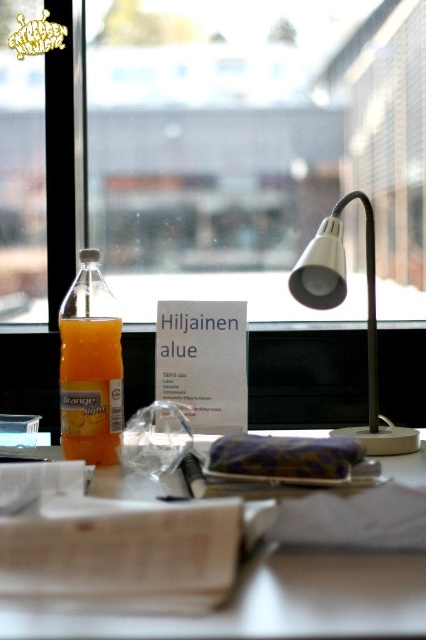
You have a large plant that needs to be placed on the transparent glass window at center or the transparent glass window sill at center. Which surface can accommodate it better based on their sizes?

The transparent glass window at center is wider than the transparent glass window sill at center, so the plant would fit better on the transparent glass window at center.